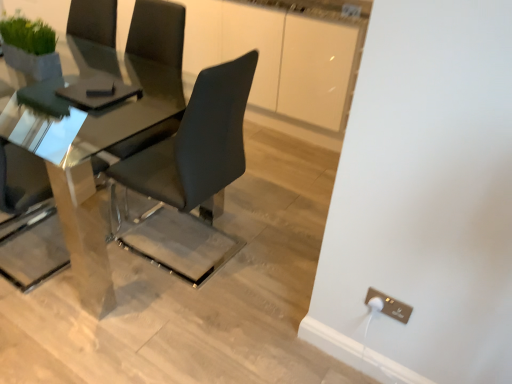
Locate an element on the screen. vacant area to the right of polished glass table at center is located at coordinates (265, 218).